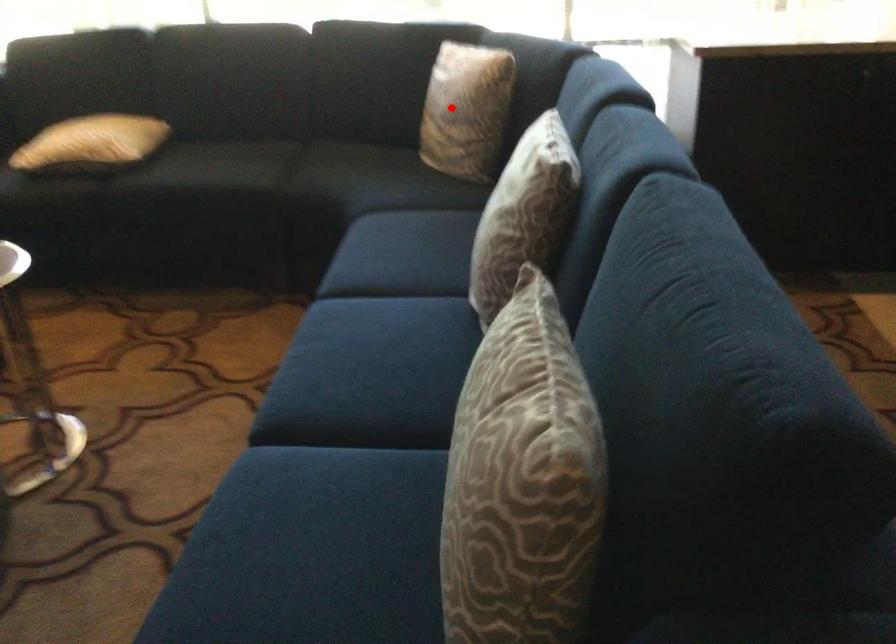
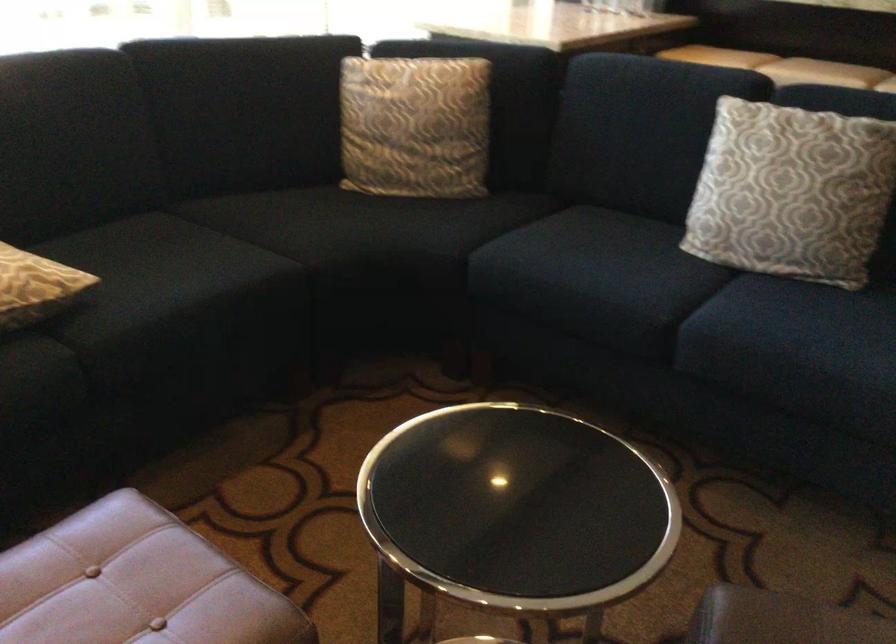
Question: I am providing you with two images of the same scene from different viewpoints. A red point is marked on the first image. Is the red point's position out of view in image 2?

Choices:
 (A) Yes
 (B) No

Answer: (B)